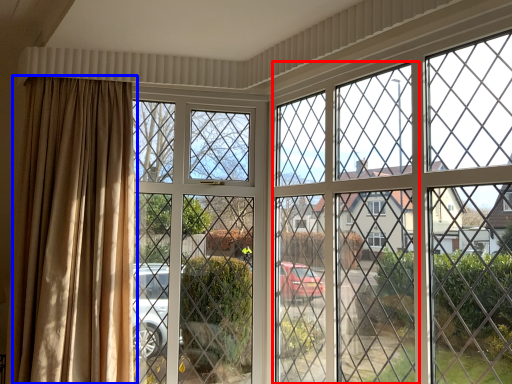
Question: Which object appears farthest to the camera in this image, screen door (highlighted by a red box) or curtain (highlighted by a blue box)?

Choices:
 (A) screen door
 (B) curtain

Answer: (B)